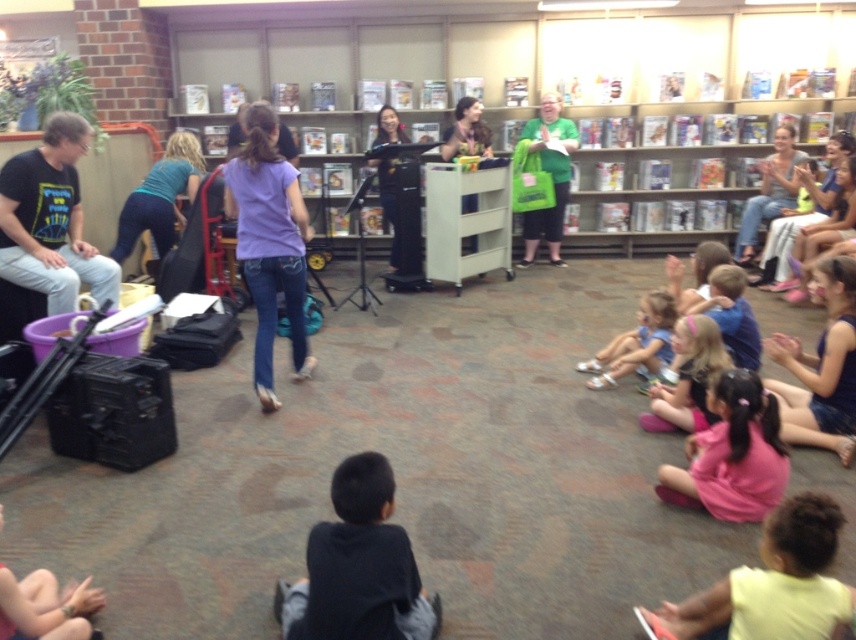
Can you confirm if black t-shirt at left is positioned to the left of light blue denim shorts at lower right?

Correct, you'll find black t-shirt at left to the left of light blue denim shorts at lower right.

Is black t-shirt at left further to camera compared to light blue denim shorts at lower right?

No.

Where is `black t-shirt at left`? black t-shirt at left is located at coordinates (51, 220).

Is point (4, 230) less distant than point (746, 502)?

No, it is not.

Is black t-shirt at left above pink fabric at lower right?

Correct, black t-shirt at left is located above pink fabric at lower right.

The height and width of the screenshot is (640, 856). Identify the location of black t-shirt at left. (51, 220).

Is purple denim jeans at center wider than light blue denim shorts at lower right?

Correct, the width of purple denim jeans at center exceeds that of light blue denim shorts at lower right.

Between purple denim jeans at center and light blue denim shorts at lower right, which one has more height?

purple denim jeans at center is taller.

Which is behind, point (253, 109) or point (664, 346)?

The point (664, 346) is more distant.

What are the coordinates of `purple denim jeans at center` in the screenshot? It's located at [269, 243].